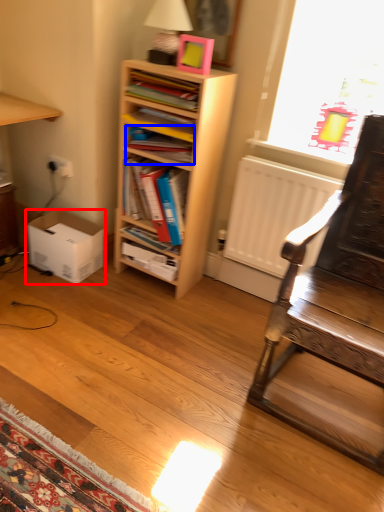
Question: Which object is further to the camera taking this photo, box (highlighted by a red box) or book (highlighted by a blue box)?

Choices:
 (A) box
 (B) book

Answer: (A)